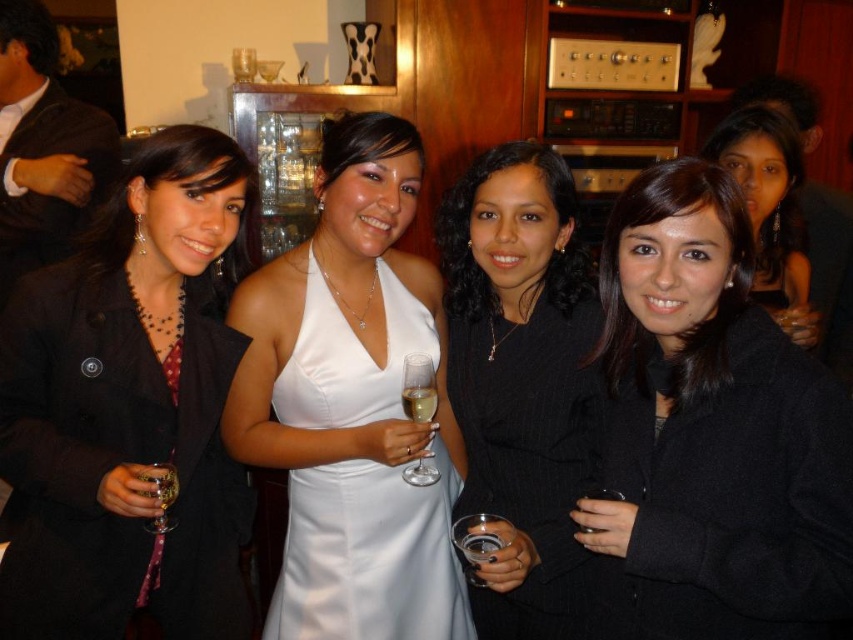
Question: Does black wool coat at center have a lesser width compared to white satin dress at center?

Choices:
 (A) yes
 (B) no

Answer: (A)

Question: Which of the following is the closest to the observer?

Choices:
 (A) (525, 516)
 (B) (585, 525)
 (C) (488, 534)
 (D) (422, 369)

Answer: (B)

Question: Can you confirm if matte black coat at left is positioned above black wool coat at lower right?

Choices:
 (A) no
 (B) yes

Answer: (A)

Question: Which is nearer to the clear glass wine glass at lower left?

Choices:
 (A) clear glass champagne at center
 (B) clear glass champagne flute at center

Answer: (A)

Question: Which of the following is the farthest from the observer?

Choices:
 (A) black pinstripe dress at center
 (B) white satin dress at center

Answer: (B)

Question: From the image, what is the correct spatial relationship of matte black coat at left in relation to black pinstripe dress at center?

Choices:
 (A) right
 (B) left

Answer: (B)